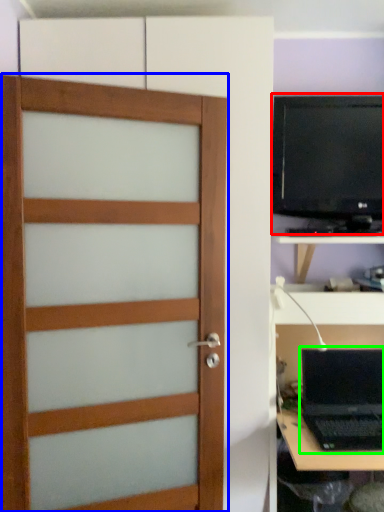
Question: Which object is the closest to the computer monitor (highlighted by a red box)? Choose among these: door (highlighted by a blue box) or laptop (highlighted by a green box).

Choices:
 (A) door
 (B) laptop

Answer: (A)